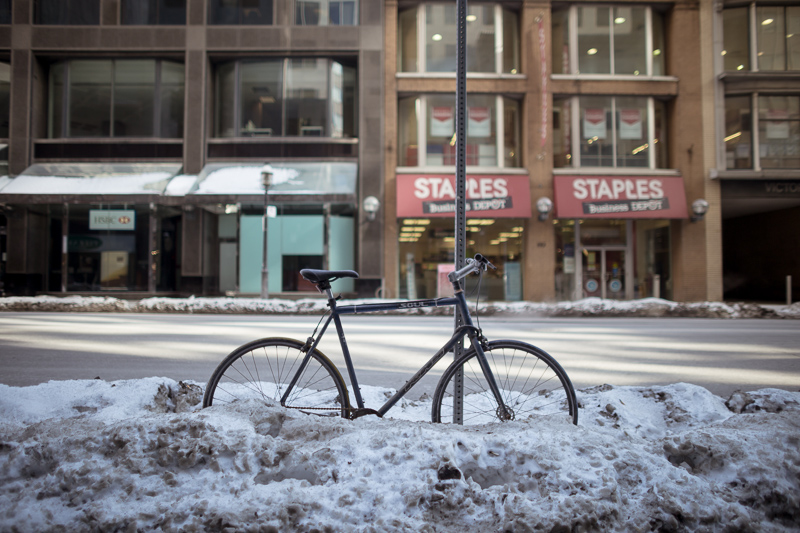
In order to click on wall in this screenshot , I will do click(x=545, y=266).